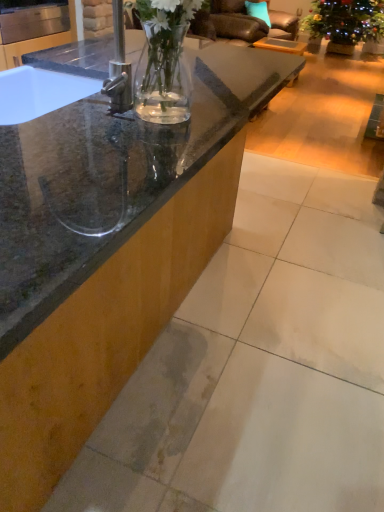
Where is `translucent glass sink at upper left`? The height and width of the screenshot is (512, 384). translucent glass sink at upper left is located at coordinates (136, 66).

This screenshot has height=512, width=384. I want to click on wooden table at center, so click(x=281, y=45).

Image resolution: width=384 pixels, height=512 pixels. I want to click on leather armchair at upper center, so coord(241,22).

What do you see at coordinates (258, 11) in the screenshot?
I see `teal fabric pillow at upper center` at bounding box center [258, 11].

This screenshot has width=384, height=512. In order to click on translucent glass sink at upper left in this screenshot , I will do `click(136, 66)`.

Which object is further away from the camera, green leafy plant at upper right or leather armchair at upper center?

Answer: Positioned behind is green leafy plant at upper right.

Locate an element on the screen. armchair lying below the green leafy plant at upper right (from the image's perspective) is located at coordinates (241, 22).

Between green leafy plant at upper right and leather armchair at upper center, which one has smaller size?

Smaller between the two is leather armchair at upper center.

Is leather armchair at upper center oriented away from teal fabric pillow at upper center?

Yes, teal fabric pillow at upper center is at the back of leather armchair at upper center.

Locate an element on the screen. The height and width of the screenshot is (512, 384). armchair that is on the left side of teal fabric pillow at upper center is located at coordinates (241, 22).

Is wooden table at center completely or partially outside of translucent glass sink at upper left?

Indeed, wooden table at center is completely outside translucent glass sink at upper left.

Based on the photo, in terms of width, does wooden table at center look wider or thinner when compared to translucent glass sink at upper left?

Considering their sizes, wooden table at center looks slimmer than translucent glass sink at upper left.

Could you tell me if wooden table at center is turned towards translucent glass sink at upper left?

No.

Considering the relative sizes of wooden table at center and translucent glass sink at upper left in the image provided, is wooden table at center shorter than translucent glass sink at upper left?

Yes.

Is green leafy plant at upper right bigger or smaller than wooden table at center?

In the image, green leafy plant at upper right appears to be larger than wooden table at center.

I want to click on table below the green leafy plant at upper right (from a real-world perspective), so click(x=281, y=45).

Can you confirm if green leafy plant at upper right is thinner than wooden table at center?

No.

Looking at this image, is wooden table at center further to camera compared to green leafy plant at upper right?

No, wooden table at center is closer to the viewer.

From the image's perspective, does wooden table at center appear higher than green leafy plant at upper right?

No, from the image's perspective, wooden table at center is not on top of green leafy plant at upper right.

Is wooden table at center directly adjacent to green leafy plant at upper right?

wooden table at center and green leafy plant at upper right are not in contact.

Does wooden table at center have a larger size compared to green leafy plant at upper right?

No.

Are translucent glass sink at upper left and green leafy plant at upper right making contact?

translucent glass sink at upper left and green leafy plant at upper right are not in contact.

Is green leafy plant at upper right at the back of translucent glass sink at upper left?

translucent glass sink at upper left does not have its back to green leafy plant at upper right.

Is translucent glass sink at upper left to the left or to the right of green leafy plant at upper right in the image?

Clearly, translucent glass sink at upper left is on the left of green leafy plant at upper right in the image.

Does translucent glass sink at upper left contain green leafy plant at upper right?

No, translucent glass sink at upper left does not contain green leafy plant at upper right.

From the image's perspective, would you say wooden table at center is shown under leather armchair at upper center?

Yes.

Where is `table that is below the leather armchair at upper center (from the image's perspective)`? Image resolution: width=384 pixels, height=512 pixels. table that is below the leather armchair at upper center (from the image's perspective) is located at coordinates (281, 45).

Does wooden table at center have a greater width compared to leather armchair at upper center?

Incorrect, the width of wooden table at center does not surpass that of leather armchair at upper center.

Can you confirm if wooden table at center is bigger than leather armchair at upper center?

Incorrect, wooden table at center is not larger than leather armchair at upper center.

Identify the location of houseplant located underneath the leather armchair at upper center (from a real-world perspective). (344, 24).

Locate an element on the screen. armchair below the teal fabric pillow at upper center (from the image's perspective) is located at coordinates (241, 22).

Based on their spatial positions, is leather armchair at upper center or teal fabric pillow at upper center further from green leafy plant at upper right?

leather armchair at upper center is further to green leafy plant at upper right.

Considering their positions, is teal fabric pillow at upper center positioned further to green leafy plant at upper right than wooden table at center?

teal fabric pillow at upper center lies further to green leafy plant at upper right than the other object.

From the image, which object appears to be farther from wooden table at center, green leafy plant at upper right or leather armchair at upper center?

leather armchair at upper center.

Which object lies nearer to the anchor point green leafy plant at upper right, wooden table at center or translucent glass sink at upper left?

wooden table at center is closer to green leafy plant at upper right.

Looking at the image, which one is located closer to green leafy plant at upper right, wooden table at center or leather armchair at upper center?

The object closer to green leafy plant at upper right is wooden table at center.

When comparing their distances from translucent glass sink at upper left, does leather armchair at upper center or green leafy plant at upper right seem further?

Based on the image, green leafy plant at upper right appears to be further to translucent glass sink at upper left.

Based on their spatial positions, is translucent glass sink at upper left or teal fabric pillow at upper center closer to wooden table at center?

teal fabric pillow at upper center is positioned closer to the anchor wooden table at center.

Looking at the image, which one is located further to green leafy plant at upper right, teal fabric pillow at upper center or leather armchair at upper center?

Based on the image, leather armchair at upper center appears to be further to green leafy plant at upper right.

At what (x,y) coordinates should I click in order to perform the action: click on table between translucent glass sink at upper left and green leafy plant at upper right in the front-back direction. Please return your answer as a coordinate pair (x, y). Looking at the image, I should click on (281, 45).

The height and width of the screenshot is (512, 384). Find the location of `table situated between teal fabric pillow at upper center and green leafy plant at upper right from left to right`. table situated between teal fabric pillow at upper center and green leafy plant at upper right from left to right is located at coordinates (281, 45).

I want to click on armchair located between translucent glass sink at upper left and teal fabric pillow at upper center in the depth direction, so click(x=241, y=22).

The height and width of the screenshot is (512, 384). Identify the location of armchair between teal fabric pillow at upper center and wooden table at center in the vertical direction. 241,22.